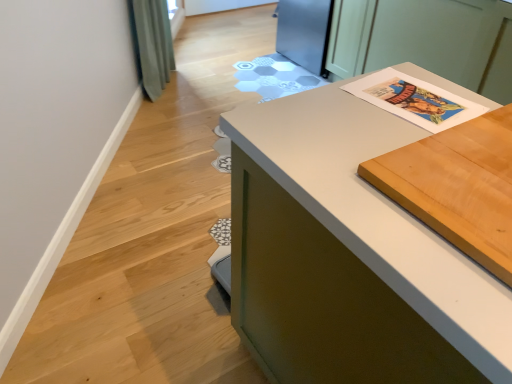
Question: In terms of width, does white paper at upper right look wider or thinner when compared to white matte countertop at center?

Choices:
 (A) wide
 (B) thin

Answer: (B)

Question: In terms of size, does white paper at upper right appear bigger or smaller than white matte countertop at center?

Choices:
 (A) small
 (B) big

Answer: (B)

Question: Which object is the closest to the light brown wood cutting board at upper right?

Choices:
 (A) white paper at upper right
 (B) white matte countertop at center

Answer: (B)

Question: Which object is the farthest from the white paper at upper right?

Choices:
 (A) white matte countertop at center
 (B) light brown wood cutting board at upper right

Answer: (B)